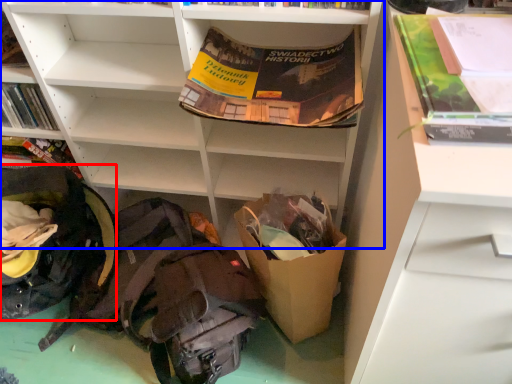
Question: Which object appears farthest to the camera in this image, backpack (highlighted by a red box) or shelf (highlighted by a blue box)?

Choices:
 (A) backpack
 (B) shelf

Answer: (A)